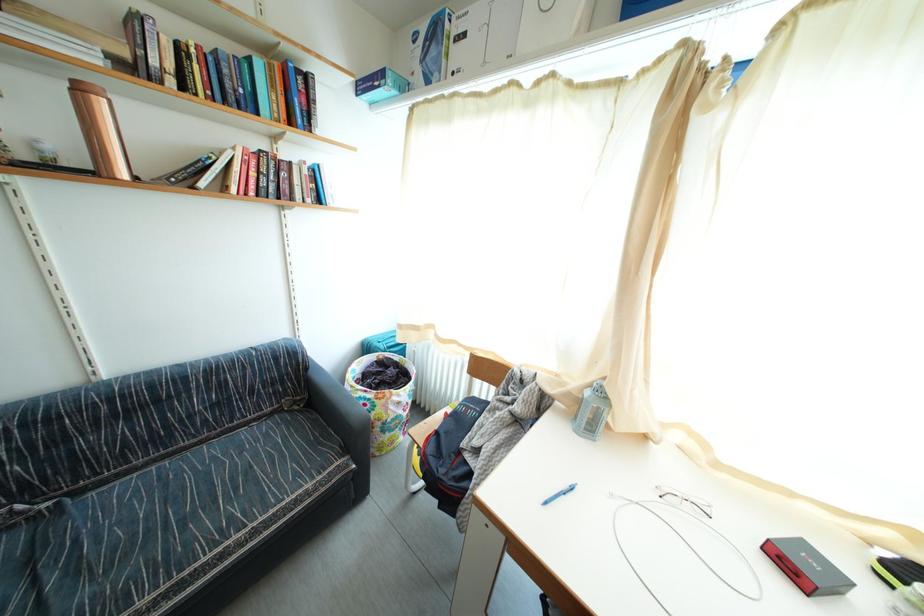
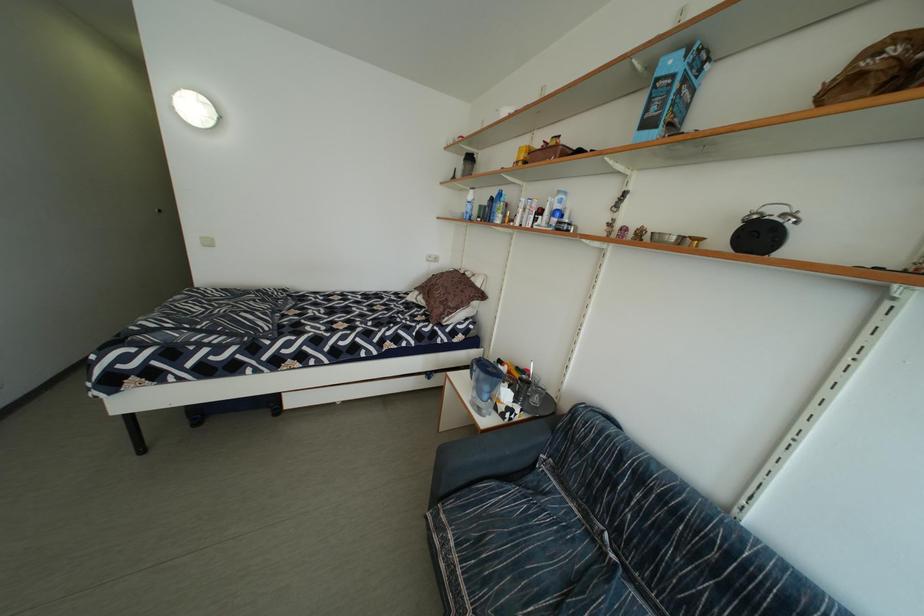
Based on the continuous images, in which direction is the camera rotating?

The rotation direction of the camera is left-down.